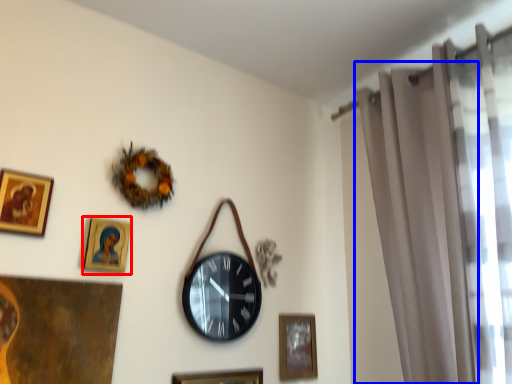
Question: Among these objects, which one is nearest to the camera, picture frame (highlighted by a red box) or curtain (highlighted by a blue box)?

Choices:
 (A) picture frame
 (B) curtain

Answer: (B)